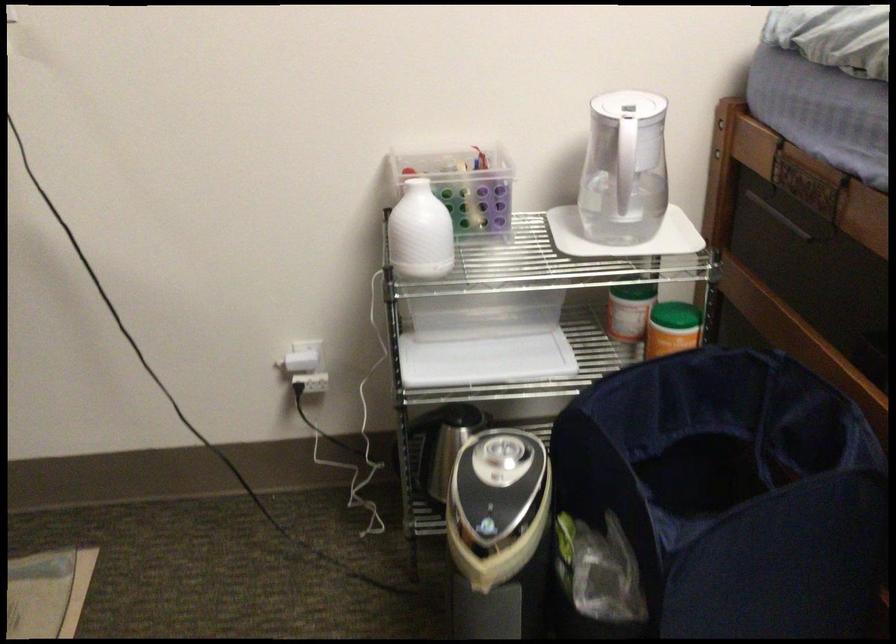
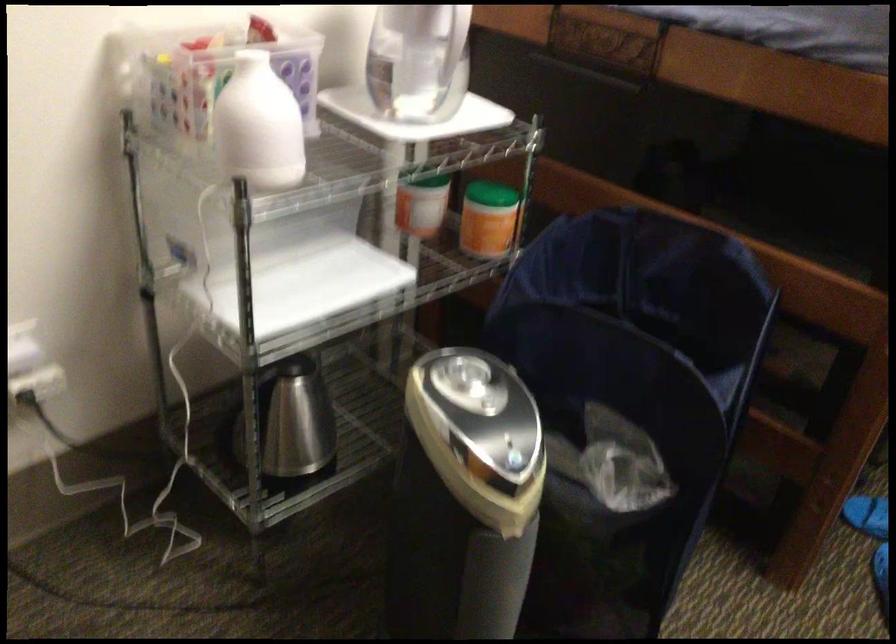
Question: The camera is either moving clockwise (left) or counter-clockwise (right) around the object. The first image is from the beginning of the video and the second image is from the end. Is the camera moving left or right when shooting the video?

Choices:
 (A) Left
 (B) Right

Answer: (A)